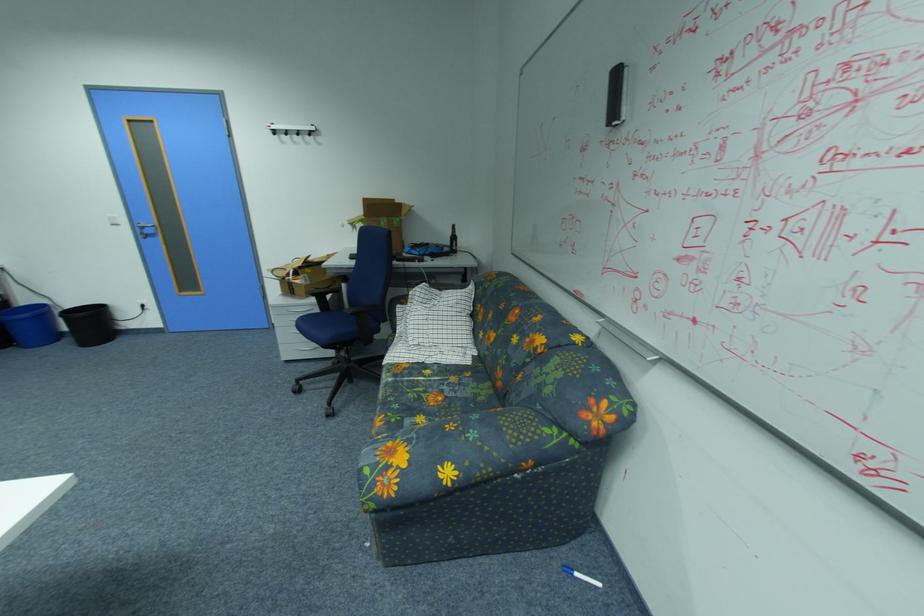
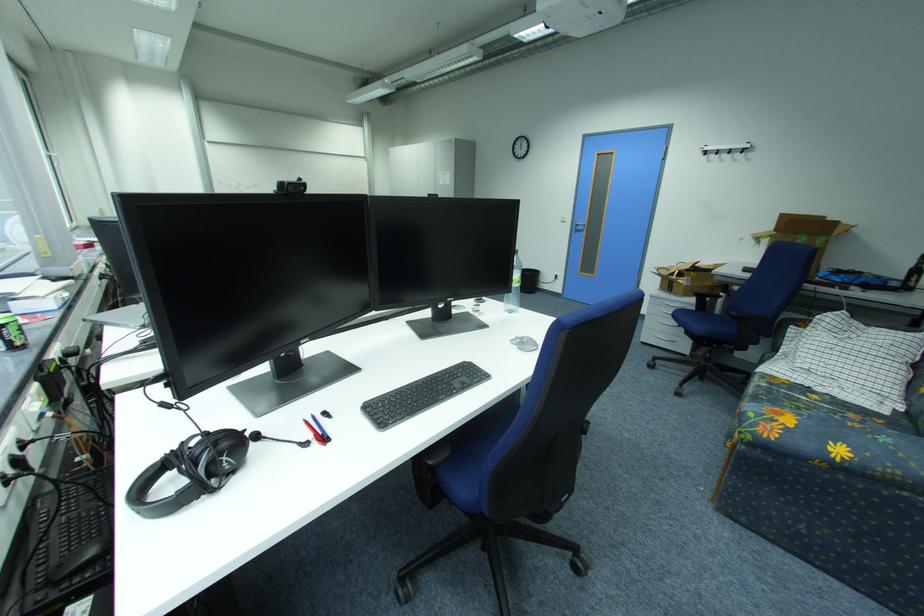
In the second image, find the point that corresponds to (296,363) in the first image.

(651, 344)